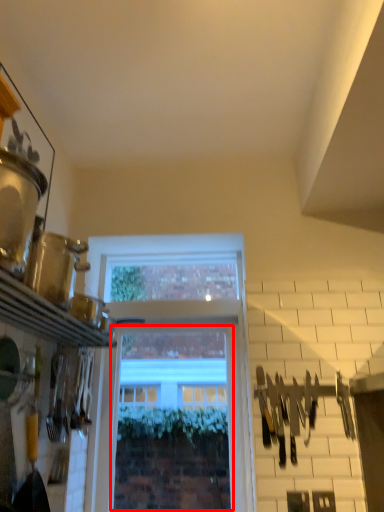
Question: From the image's perspective, what is the correct spatial positioning of window (annotated by the red box) in reference to tool?

Choices:
 (A) below
 (B) above

Answer: (A)